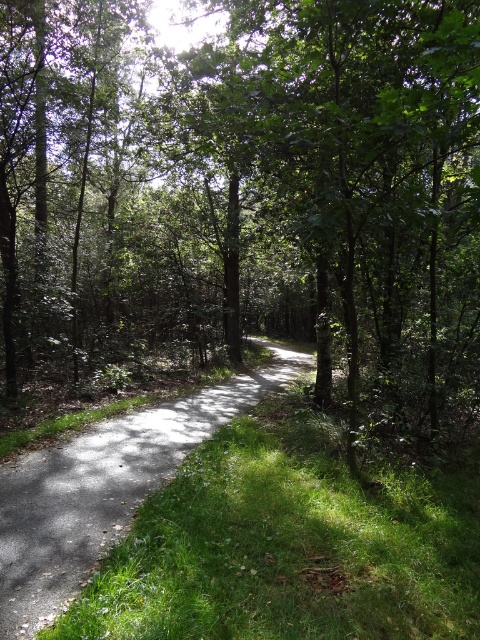
You are a hiker trying to stay on the gray asphalt trail at center while avoiding the green leafy tree at center. Is the trail wide enough for you to pass safely?

The green leafy tree at center is wider than the gray asphalt trail at center, so the trail may not be wide enough to pass safely without touching the tree.

You are standing at the entrance of the forest path and notice a green leafy tree at center. Based on its position, can you determine if it is closer to the left or right side of the path?

The green leafy tree at center is located at point coordinates, which places it centrally along the path. Therefore, it is equidistant from both the left and right sides of the path.